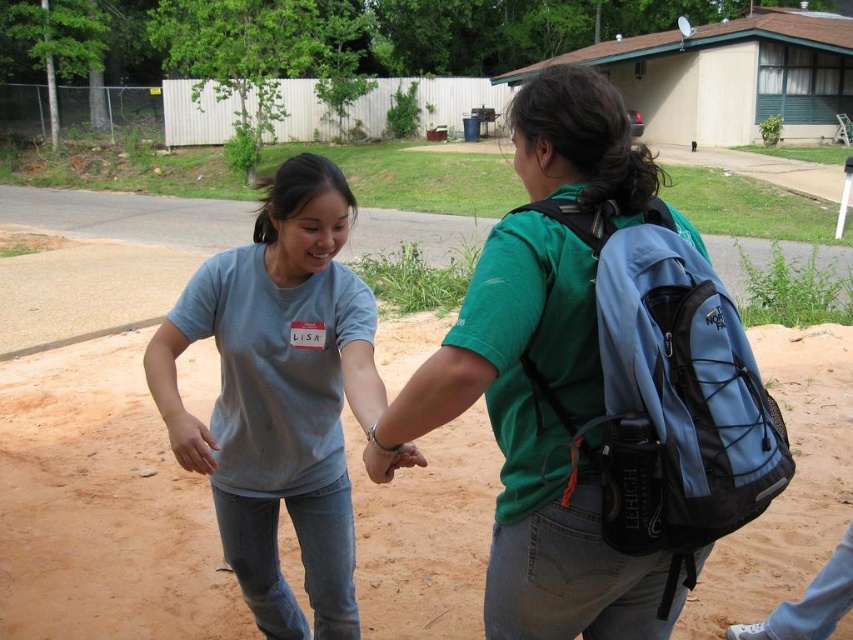
You are taking a photo of the two people in the scene. You want to focus on the person closer to the camera. Which point should you focus on, point (614, 148) or point (316, 480)?

Point (614, 148) is closer to the camera than point (316, 480), so you should focus on point (614, 148).